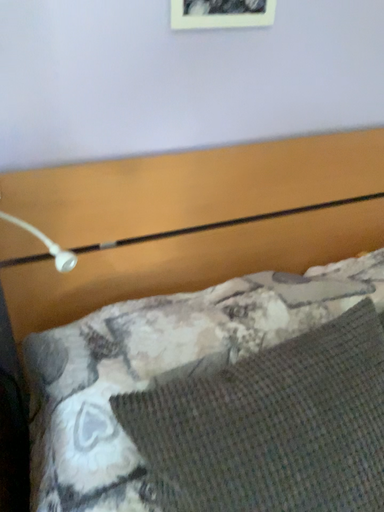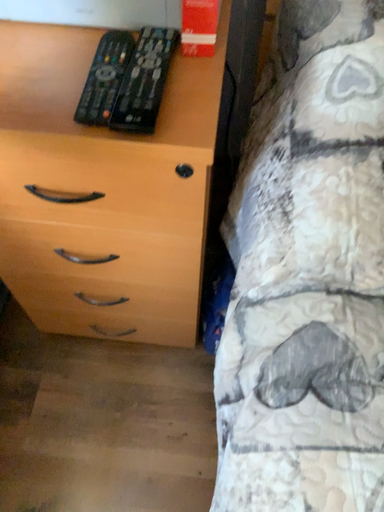
Question: Which way did the camera rotate in the video?

Choices:
 (A) rotated right
 (B) rotated left

Answer: (B)